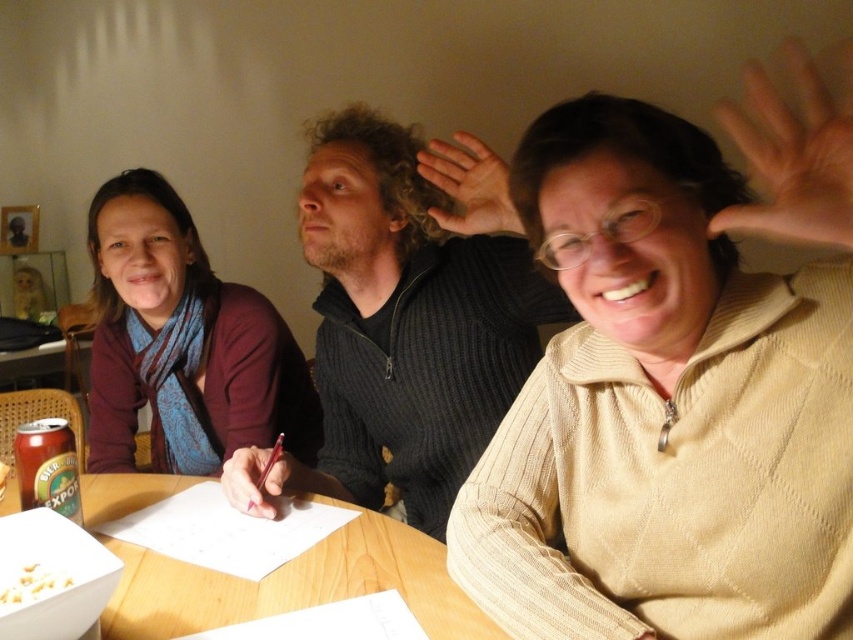
Which is above, matte skin hand at center or matte red pen at center?

matte skin hand at center is higher up.

Is matte skin hand at center closer to the viewer compared to matte red pen at center?

That is True.

At what (x,y) coordinates should I click in order to perform the action: click on matte skin hand at center. Please return your answer as a coordinate pair (x, y). This screenshot has width=853, height=640. Looking at the image, I should click on (469, 186).

This screenshot has width=853, height=640. I want to click on matte skin hand at center, so click(x=469, y=186).

Based on the photo, can you confirm if light skin palm at upper right is smaller than matte skin hand at center?

Incorrect, light skin palm at upper right is not smaller in size than matte skin hand at center.

Between point (827, 170) and point (434, 177), which one is positioned behind?

The point (434, 177) is more distant.

What do you see at coordinates (793, 154) in the screenshot? I see `light skin palm at upper right` at bounding box center [793, 154].

Where is `light skin palm at upper right`? This screenshot has height=640, width=853. light skin palm at upper right is located at coordinates (793, 154).

Which is behind, point (809, 186) or point (26, 600)?

Point (26, 600)

Does point (776, 211) come behind point (38, 579)?

No.

Locate an element on the screen. light skin palm at upper right is located at coordinates (793, 154).